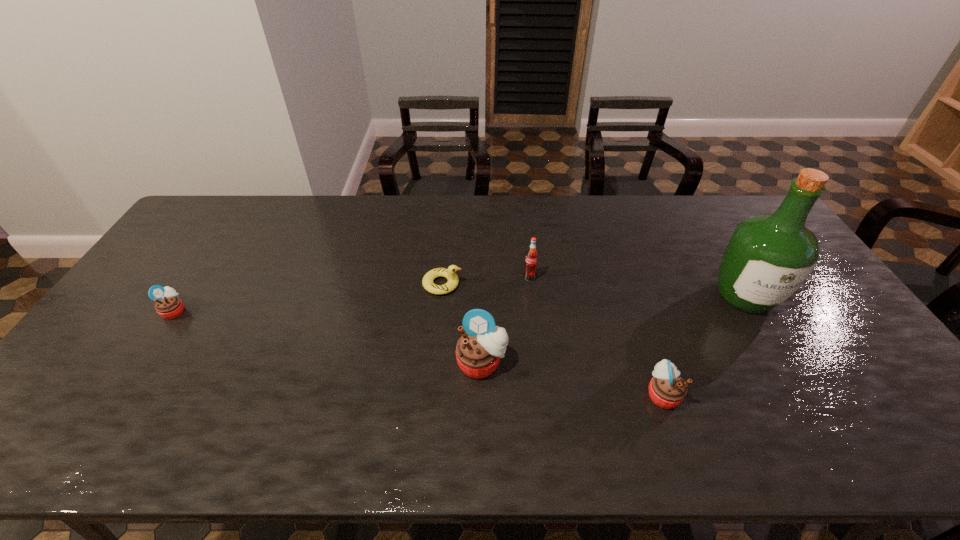
Find the location of a particular element. the shortest muffin is located at coordinates (168, 305).

The width and height of the screenshot is (960, 540). What are the coordinates of `the leftmost muffin` in the screenshot? It's located at (168, 305).

The height and width of the screenshot is (540, 960). In order to click on the second muffin from left to right in this screenshot , I will do `click(478, 351)`.

Where is `the second tallest muffin`? the second tallest muffin is located at coordinates (667, 389).

Find the location of a particular element. This screenshot has width=960, height=540. the rightmost muffin is located at coordinates (667, 389).

Image resolution: width=960 pixels, height=540 pixels. I want to click on the rightmost object, so click(769, 256).

Where is `liquor`? This screenshot has height=540, width=960. liquor is located at coordinates (769, 256).

Image resolution: width=960 pixels, height=540 pixels. In order to click on soda bottle in this screenshot , I will do `click(531, 260)`.

Locate an element on the screen. the shortest object is located at coordinates (449, 273).

Locate an element on the screen. free spot located on the front-facing side of the fifth tallest object is located at coordinates (252, 311).